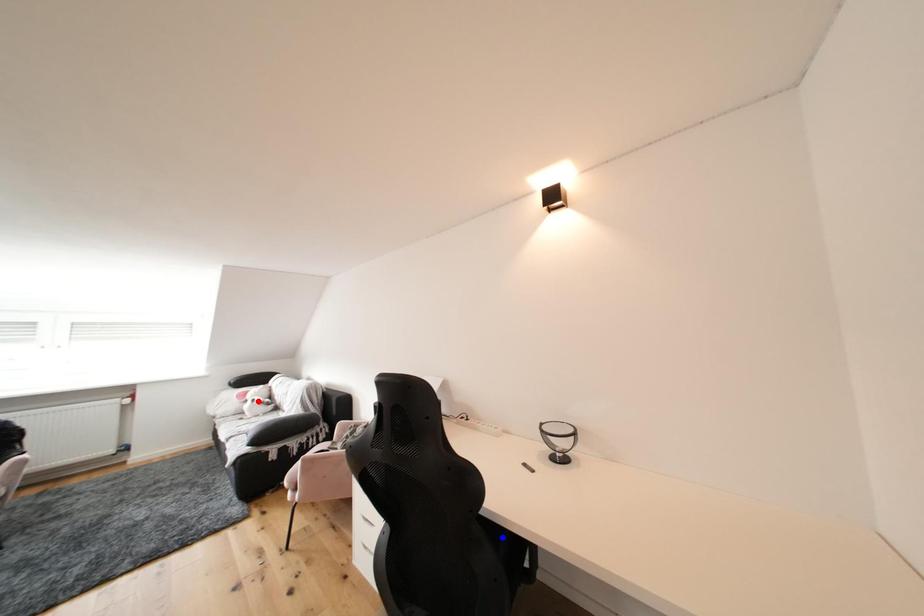
Question: Which of the two points in the image is closer to the camera?

Choices:
 (A) Blue point is closer.
 (B) Red point is closer.

Answer: (A)